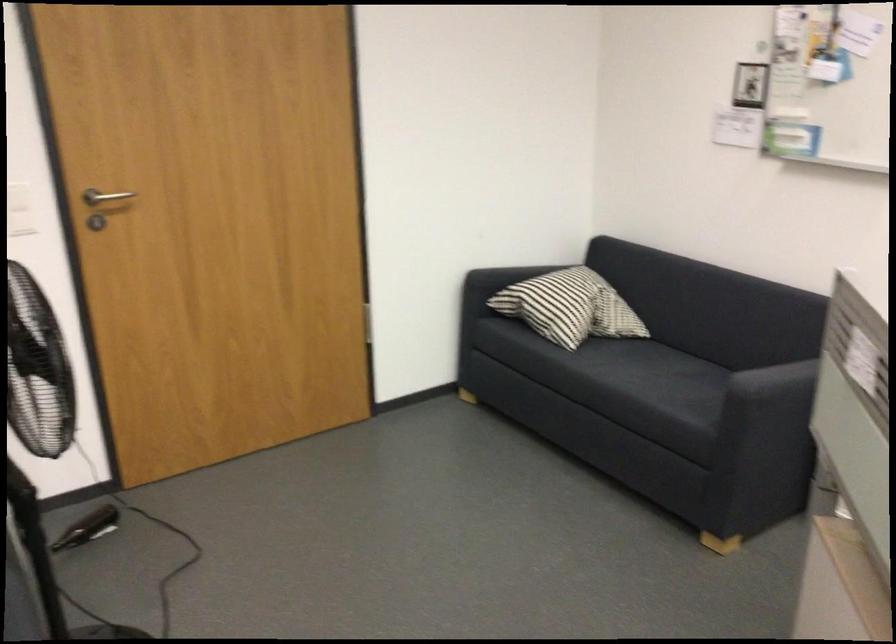
Where would you grasp the striped pillow? Please return your answer as a coordinate pair (x, y).

(570, 307)